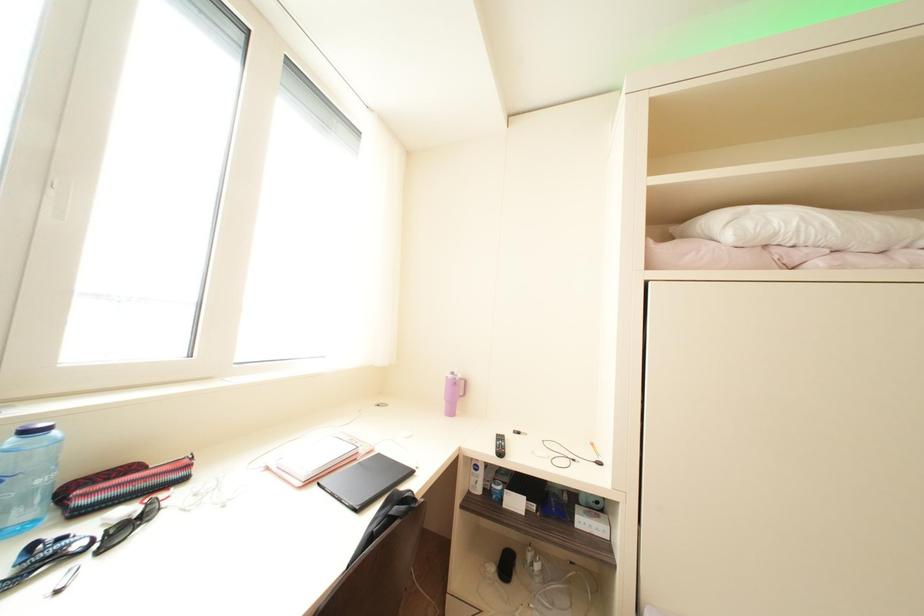
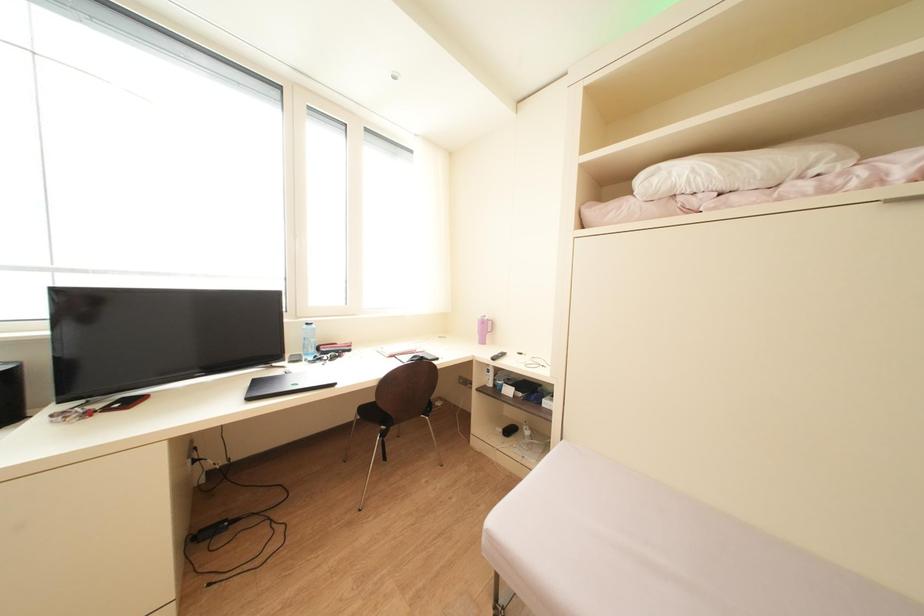
In a continuous first-person perspective shot, in which direction is the camera moving?

The cameraman moved toward right, backward.